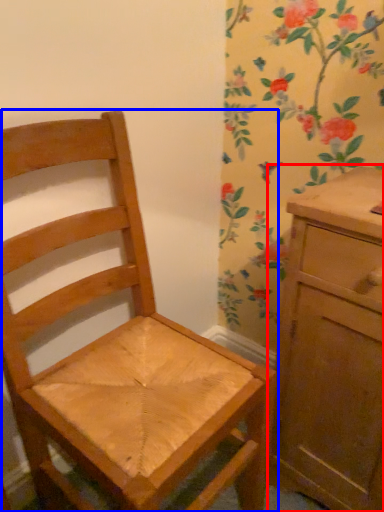
Question: Which object appears farthest to the camera in this image, chest of drawers (highlighted by a red box) or chair (highlighted by a blue box)?

Choices:
 (A) chest of drawers
 (B) chair

Answer: (A)